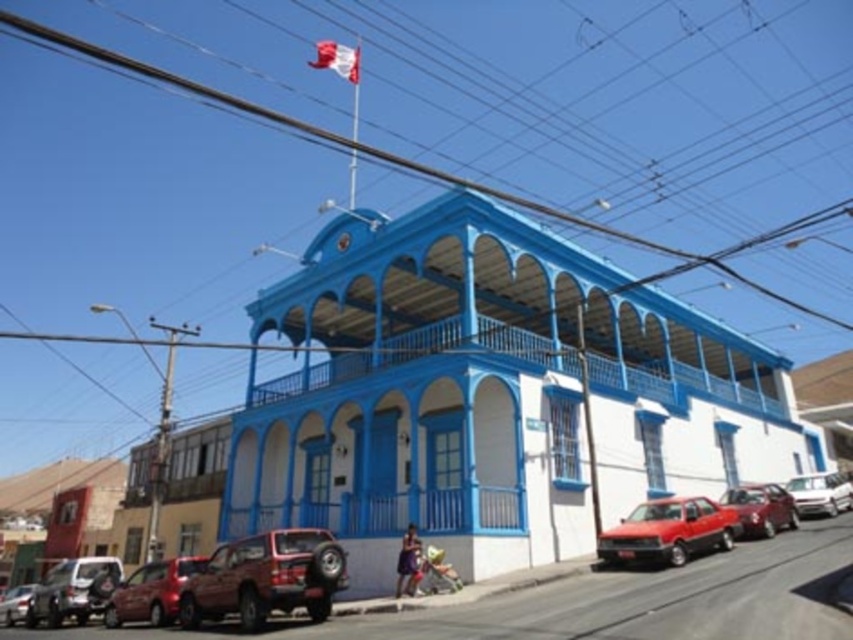
Can you confirm if shiny red car at center is positioned above silver metallic sedan at right?

Indeed, shiny red car at center is positioned over silver metallic sedan at right.

Can you confirm if shiny red car at center is positioned to the right of silver metallic sedan at right?

Incorrect, shiny red car at center is not on the right side of silver metallic sedan at right.

I want to click on shiny red car at center, so click(761, 508).

This screenshot has width=853, height=640. Find the location of `shiny red car at center`. shiny red car at center is located at coordinates (761, 508).

How much distance is there between shiny red car at lower right and metallic silver car at lower left?

shiny red car at lower right and metallic silver car at lower left are 51.10 meters apart.

Who is positioned more to the left, shiny red car at lower right or metallic silver car at lower left?

metallic silver car at lower left is more to the left.

Identify the location of shiny red car at lower right. The width and height of the screenshot is (853, 640). (668, 531).

Identify the location of shiny red car at lower right. (668, 531).

Can you confirm if shiny red car at lower right is wider than red and white fabric flag at upper center?

In fact, shiny red car at lower right might be narrower than red and white fabric flag at upper center.

Between point (706, 506) and point (352, 83), which one is positioned in front?

Point (706, 506) is more forward.

Locate an element on the screen. The width and height of the screenshot is (853, 640). shiny red car at lower right is located at coordinates (668, 531).